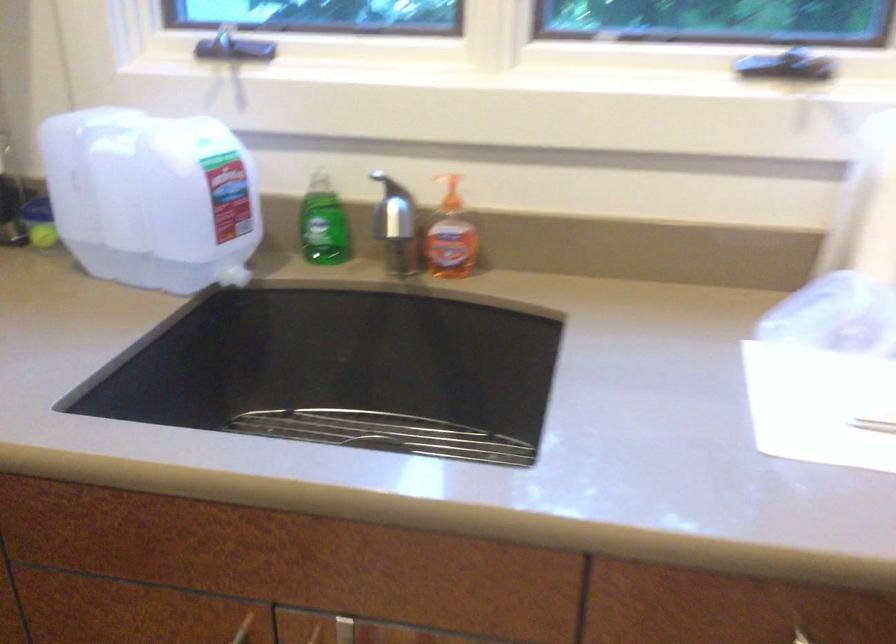
Image resolution: width=896 pixels, height=644 pixels. What are the coordinates of `black window latch` in the screenshot? It's located at (243, 48).